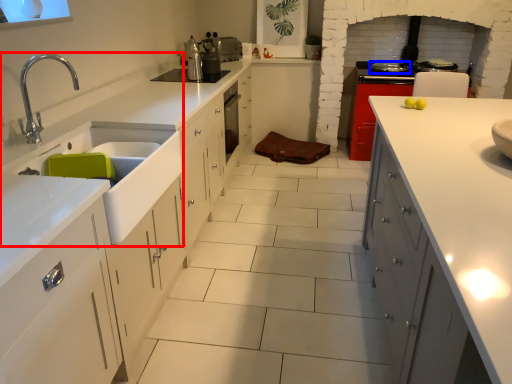
Question: Which of the following is the farthest to the observer, sink (highlighted by a red box) or kitchen appliance (highlighted by a blue box)?

Choices:
 (A) sink
 (B) kitchen appliance

Answer: (B)